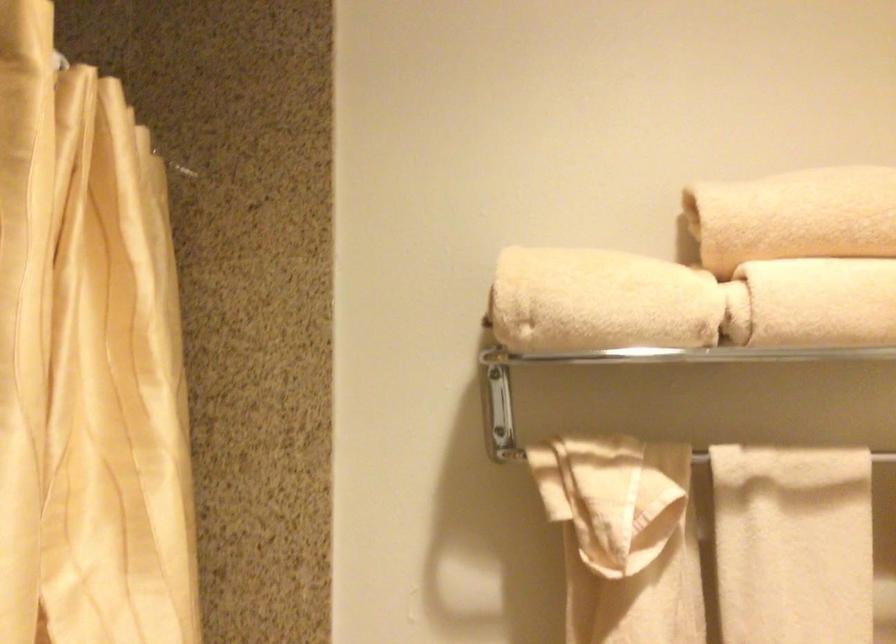
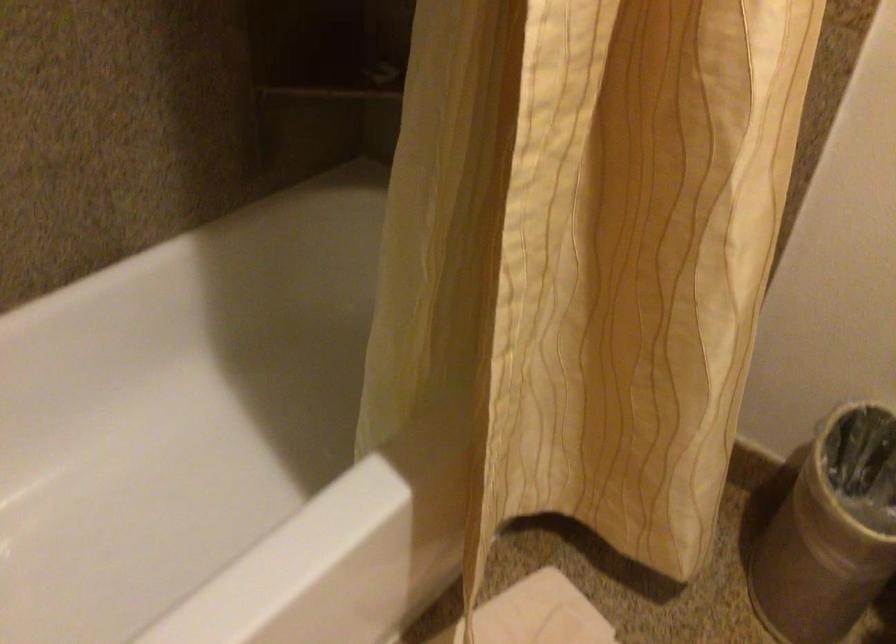
The first image is from the beginning of the video and the second image is from the end. How did the camera likely rotate when shooting the video?

The camera rotated toward left-down.